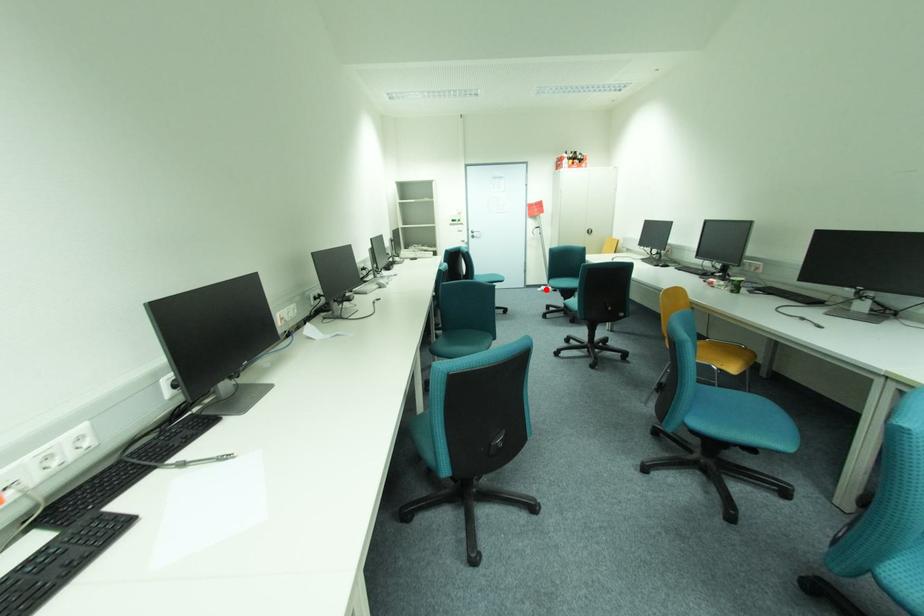
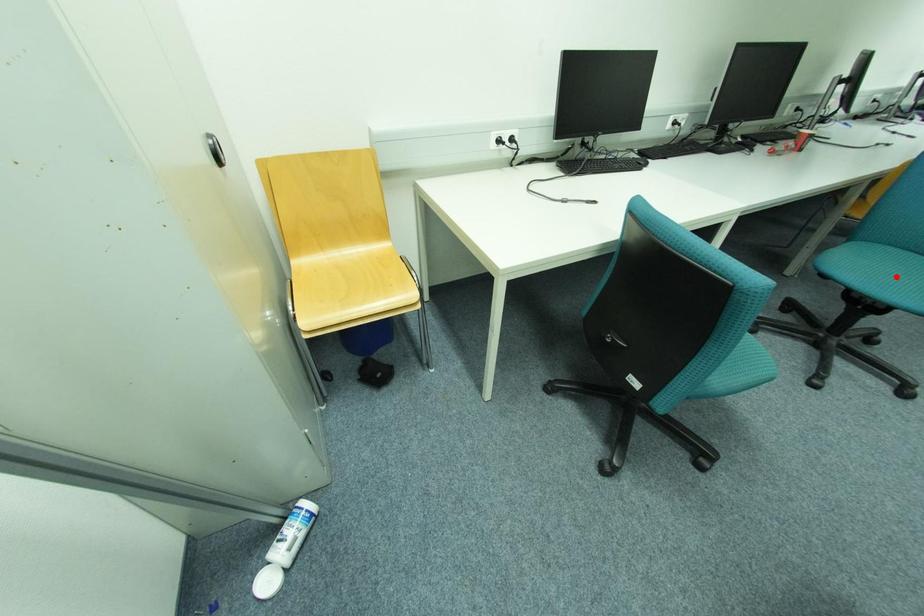
I am providing you with two images of the same scene from different viewpoints. A red point is marked on the first image and another point is marked on the second image. Are the points marked in image1 and image2 representing the same 3D position?

No